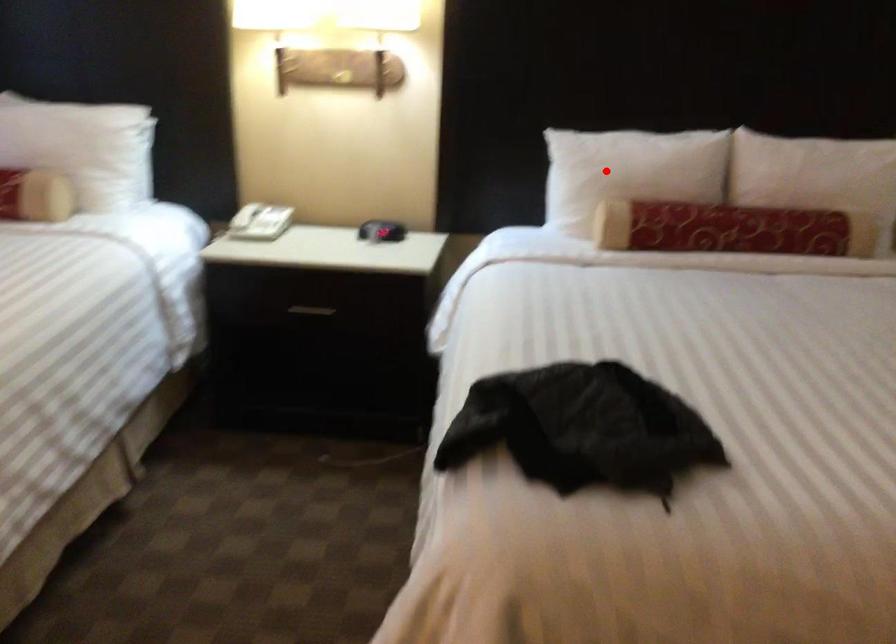
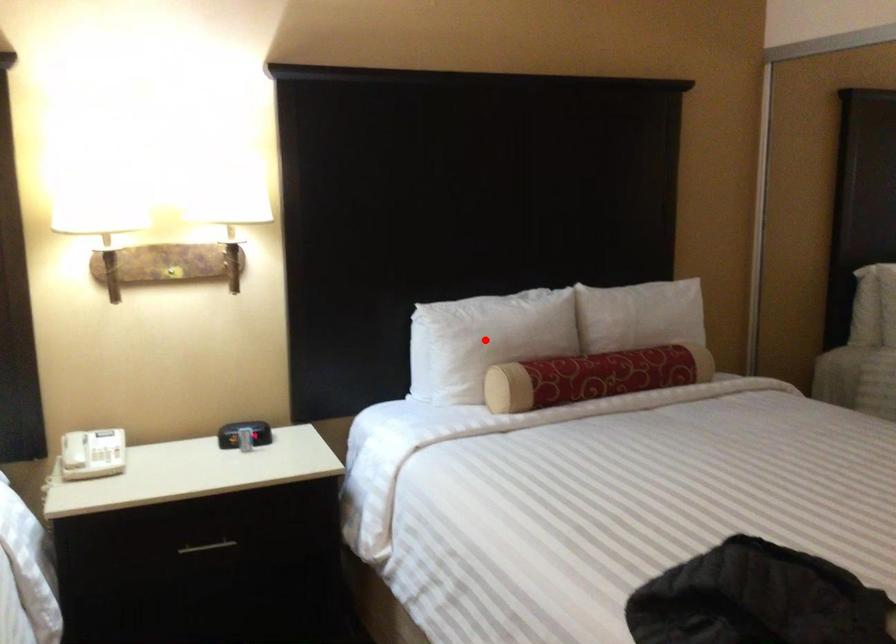
I am providing you with two images of the same scene from different viewpoints. A red point is marked on the first image and another point is marked on the second image. Are the points marked in image1 and image2 representing the same 3D position?

Yes